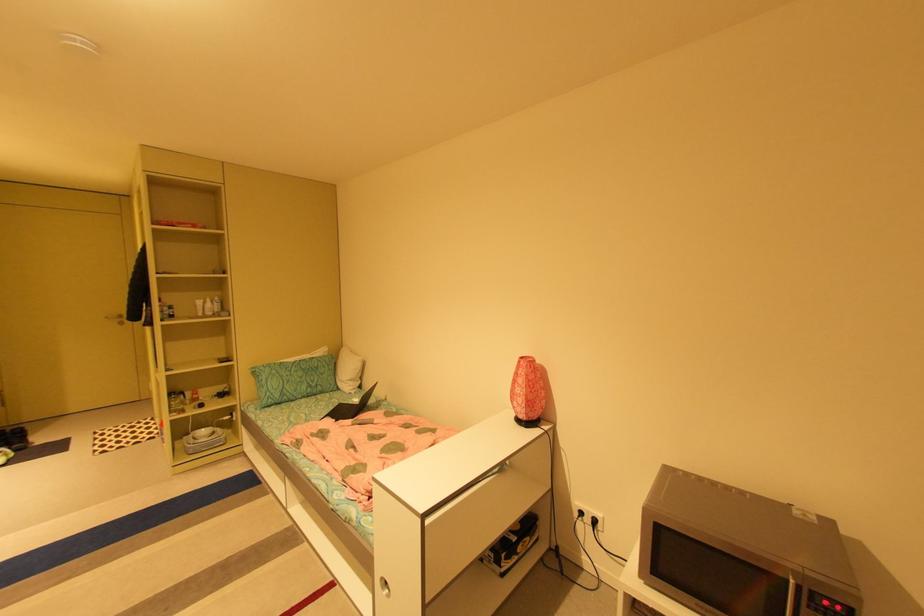
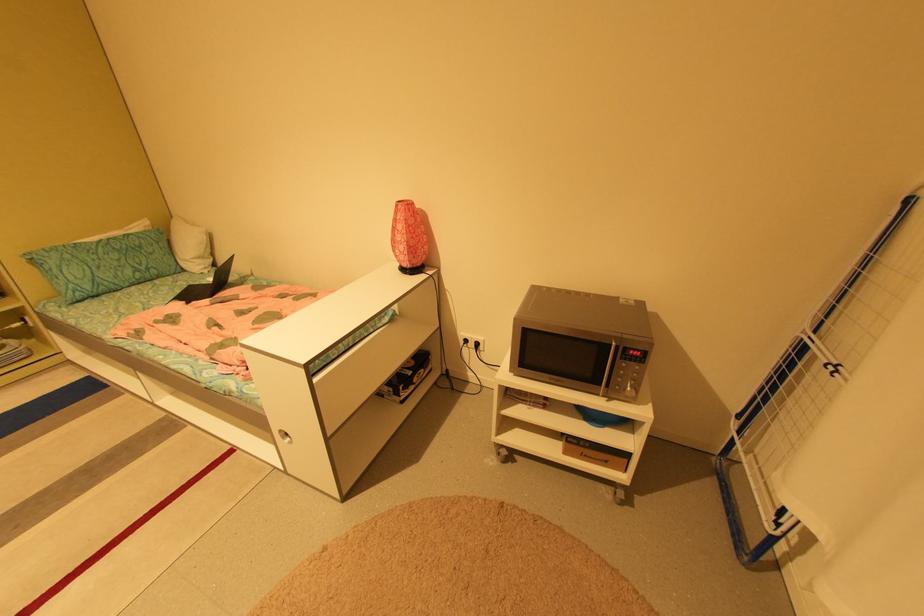
In the second image, find the point that corresponds to pixel 345 389 in the first image.

(190, 270)